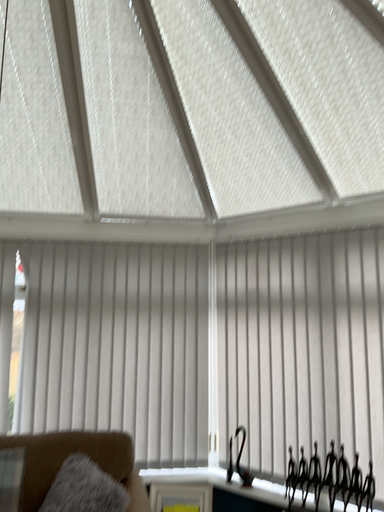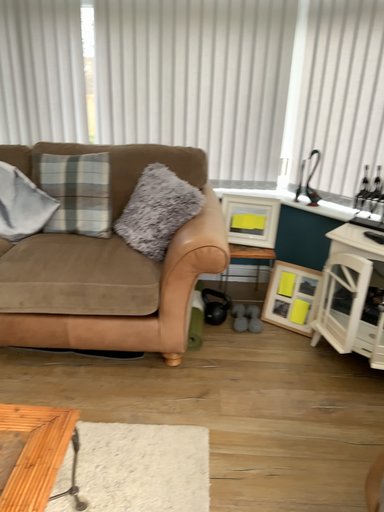
Question: How did the camera likely rotate when shooting the video?

Choices:
 (A) rotated upward
 (B) rotated downward

Answer: (B)